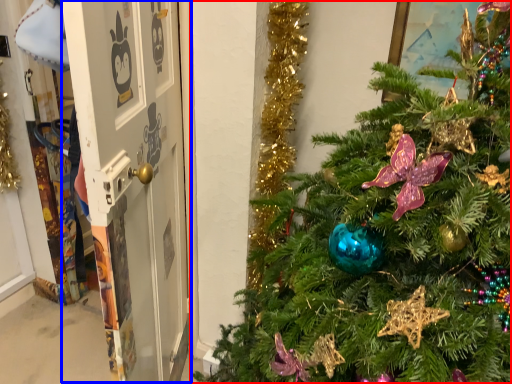
Question: Which object is closer to the camera taking this photo, christmas tree (highlighted by a red box) or screen door (highlighted by a blue box)?

Choices:
 (A) christmas tree
 (B) screen door

Answer: (A)